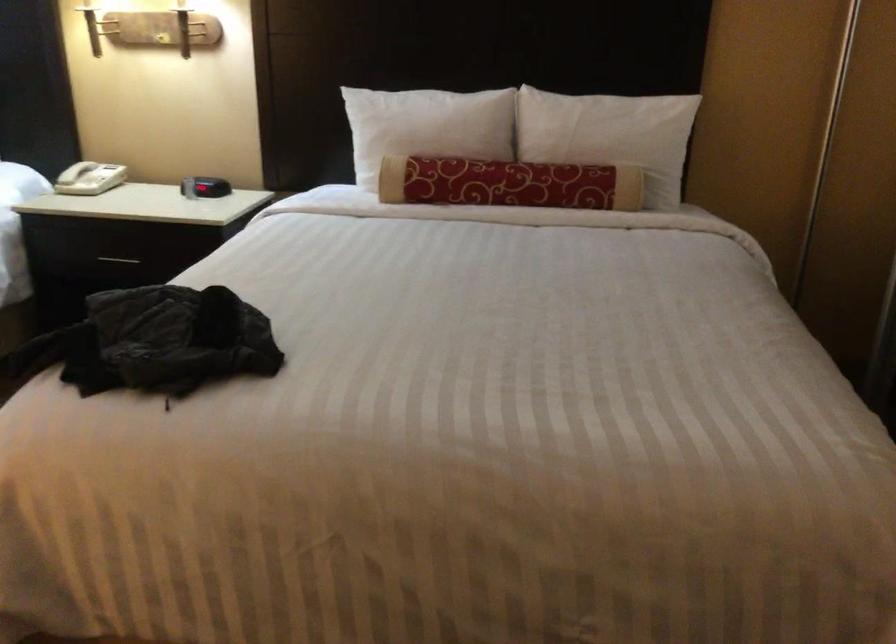
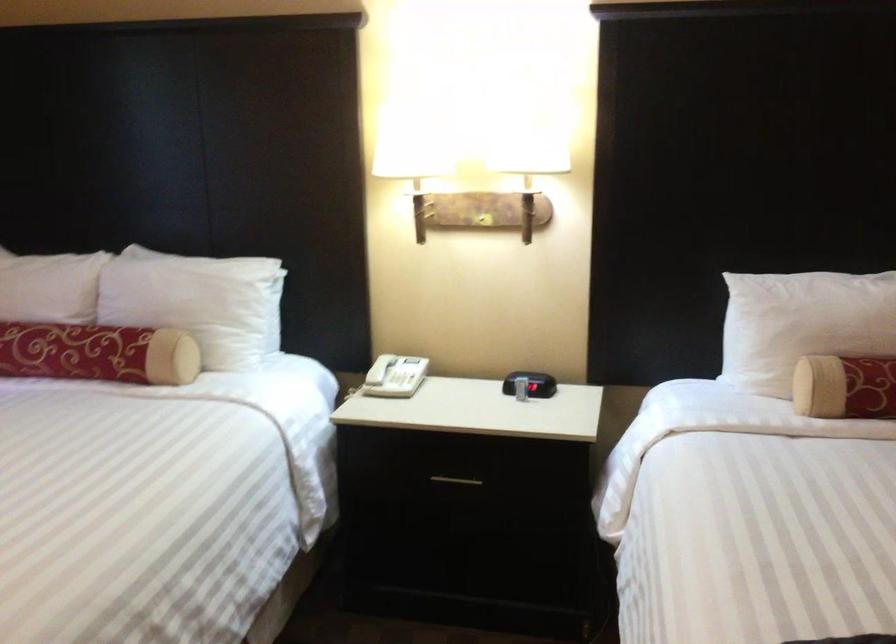
Find the pixel in the second image that matches point (91, 176) in the first image.

(405, 380)